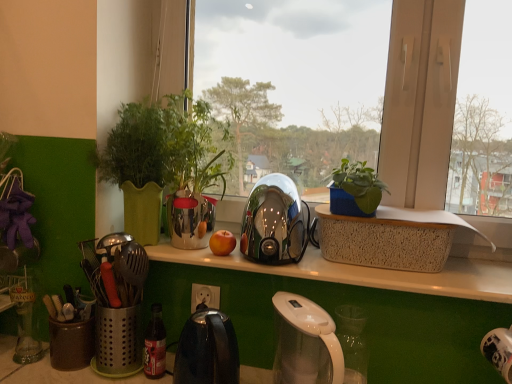
This screenshot has height=384, width=512. What are the coordinates of `free space to the right of red matte apple at center` in the screenshot? It's located at (294, 263).